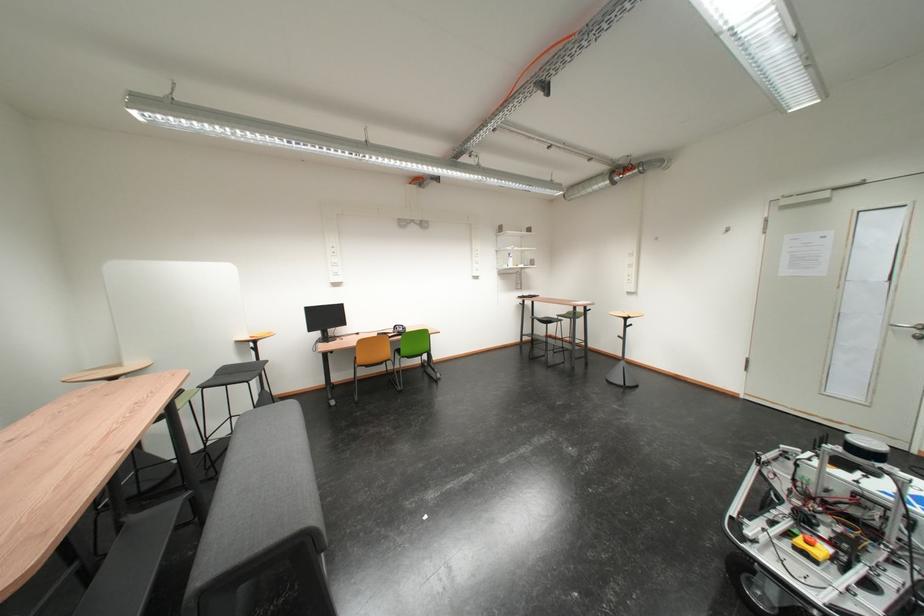
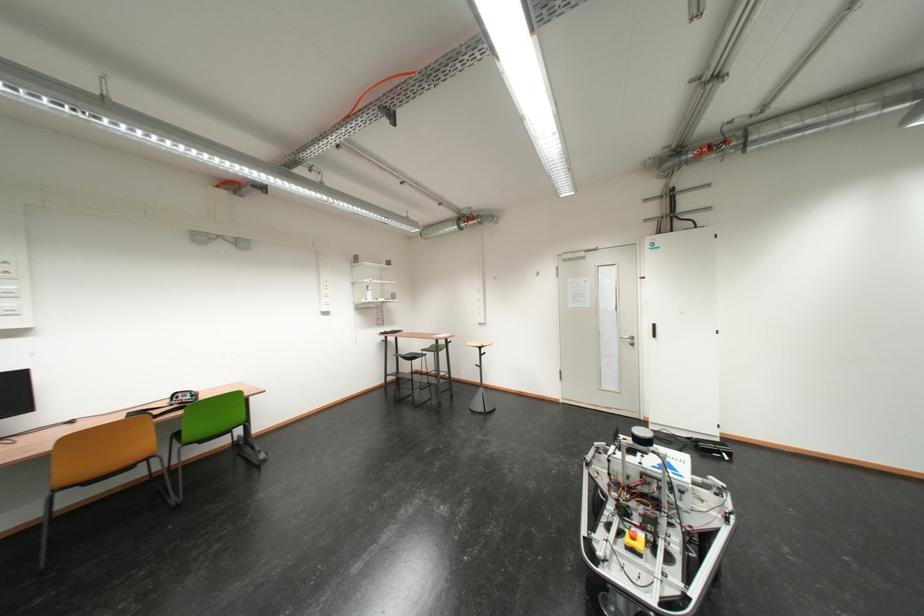
Question: The images are taken continuously from a first-person perspective. In which direction is your viewpoint rotating?

Choices:
 (A) Left
 (B) Right
 (C) Up
 (D) Down

Answer: (B)